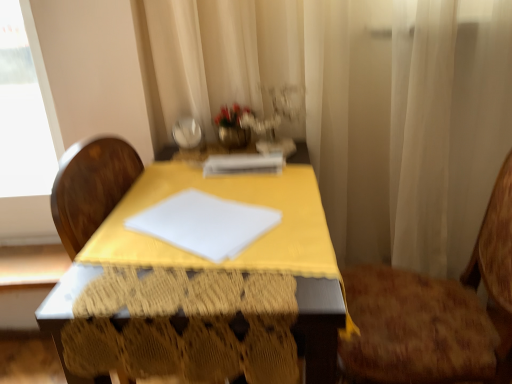
Where is `free space to the left of white paper at center`? free space to the left of white paper at center is located at coordinates (176, 171).